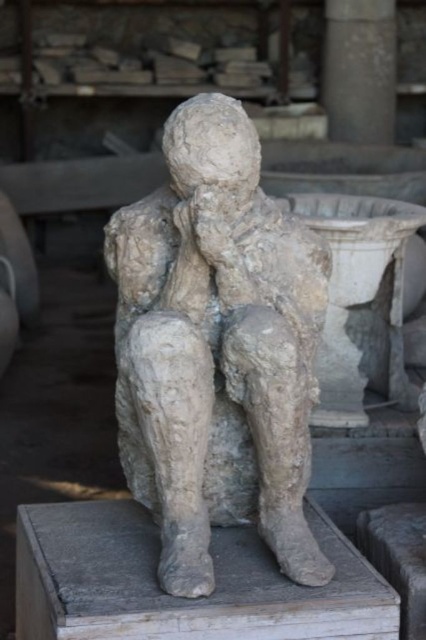
You are an art conservator examining the placement of the gray stone statue at center and the smooth gray stone pillar at upper center. Based on their positions, which object is positioned higher in the image?

The smooth gray stone pillar at upper center is positioned higher than the gray stone statue at center.

Looking at this image, you are an art conservator examining the scene. You need to determine which object is bigger between the gray stone statue at center and the smooth gray stone pillar at upper center. Which one is larger?

The gray stone statue at center has a larger size compared to the smooth gray stone pillar at upper center, so the gray stone statue at center is larger.

What is located at the coordinates point [216,349] in the image?

The gray stone statue at center is located at point [216,349].